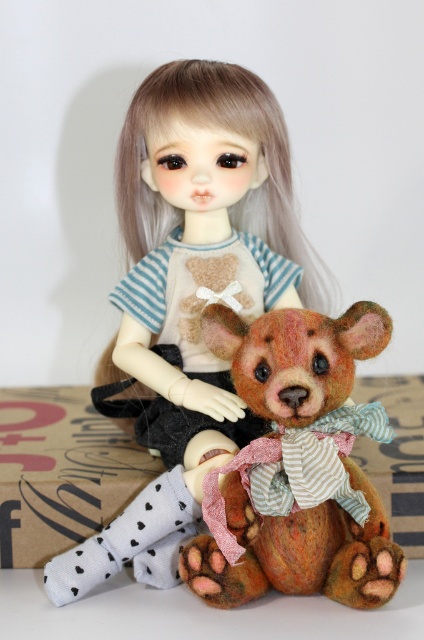
Question: Is matte beige doll at center wider than textured brown bear at center?

Choices:
 (A) no
 (B) yes

Answer: (B)

Question: Is matte beige doll at center to the left of textured brown bear at center from the viewer's perspective?

Choices:
 (A) no
 (B) yes

Answer: (B)

Question: Which point appears farthest from the camera in this image?

Choices:
 (A) (292, 376)
 (B) (147, 237)

Answer: (B)

Question: Can you confirm if matte beige doll at center is smaller than textured brown bear at center?

Choices:
 (A) yes
 (B) no

Answer: (B)

Question: Which of the following is the closest to the observer?

Choices:
 (A) (223, 262)
 (B) (276, 582)

Answer: (B)

Question: Among these points, which one is farthest from the camera?

Choices:
 (A) (147, 148)
 (B) (275, 577)

Answer: (A)